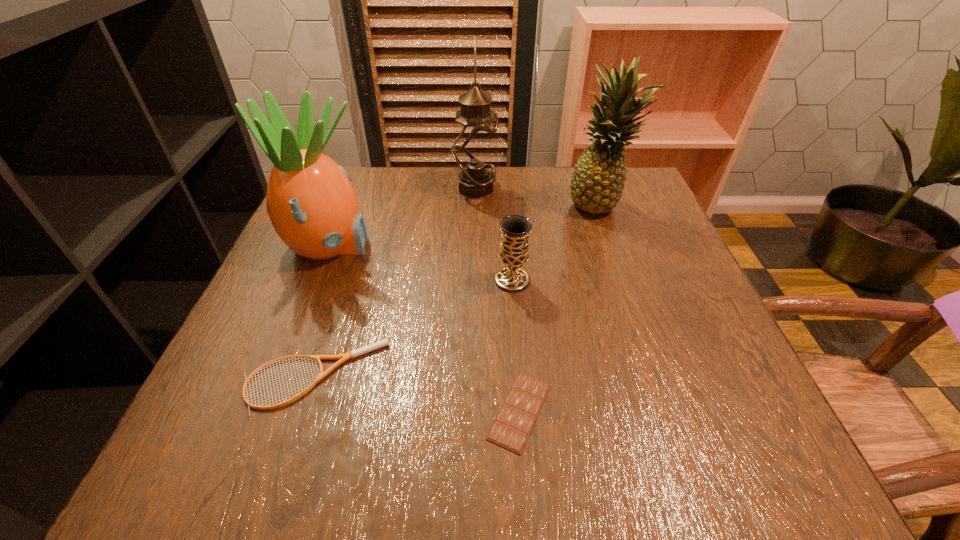
Find the location of a particular element. This screenshot has height=540, width=960. vacant area that lies between the left pineapple and the shortest object is located at coordinates (424, 329).

At what (x,y) coordinates should I click in order to perform the action: click on free space between the oil lamp and the chocolate bar. Please return your answer as a coordinate pair (x, y). The image size is (960, 540). Looking at the image, I should click on (497, 299).

The width and height of the screenshot is (960, 540). Find the location of `free space between the rightmost object and the shortest object`. free space between the rightmost object and the shortest object is located at coordinates (560, 307).

The image size is (960, 540). Find the location of `free point between the oil lamp and the left pineapple`. free point between the oil lamp and the left pineapple is located at coordinates (402, 218).

The height and width of the screenshot is (540, 960). I want to click on free spot between the oil lamp and the chocolate bar, so click(x=497, y=299).

Image resolution: width=960 pixels, height=540 pixels. I want to click on unoccupied area between the oil lamp and the rightmost object, so click(538, 195).

This screenshot has width=960, height=540. In order to click on the fifth closest object relative to the rightmost object in this screenshot , I will do `click(352, 354)`.

Select which object is the third closest to the chalice. Please provide its 2D coordinates. Your answer should be formatted as a tuple, i.e. [(x, y)], where the tuple contains the x and y coordinates of a point satisfying the conditions above.

[(352, 354)]

This screenshot has height=540, width=960. Find the location of `free point that satisfies the following two spatial constraints: 1. at the entrance of the chalice; 2. on the left side of the left pineapple`. free point that satisfies the following two spatial constraints: 1. at the entrance of the chalice; 2. on the left side of the left pineapple is located at coordinates (316, 280).

Find the location of a particular element. The image size is (960, 540). free spot that satisfies the following two spatial constraints: 1. on the back side of the third shortest object; 2. at the entrance of the left pineapple is located at coordinates (510, 247).